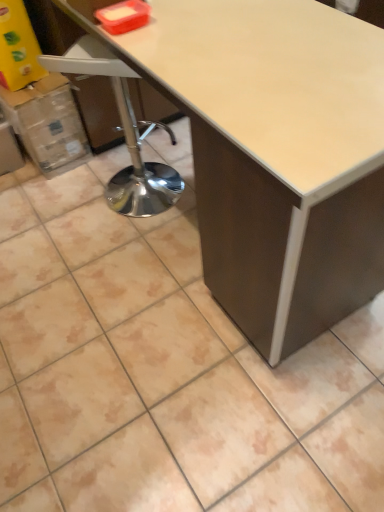
Find the location of a particular element. free space to the left of white plastic swivel chair at left is located at coordinates (70, 203).